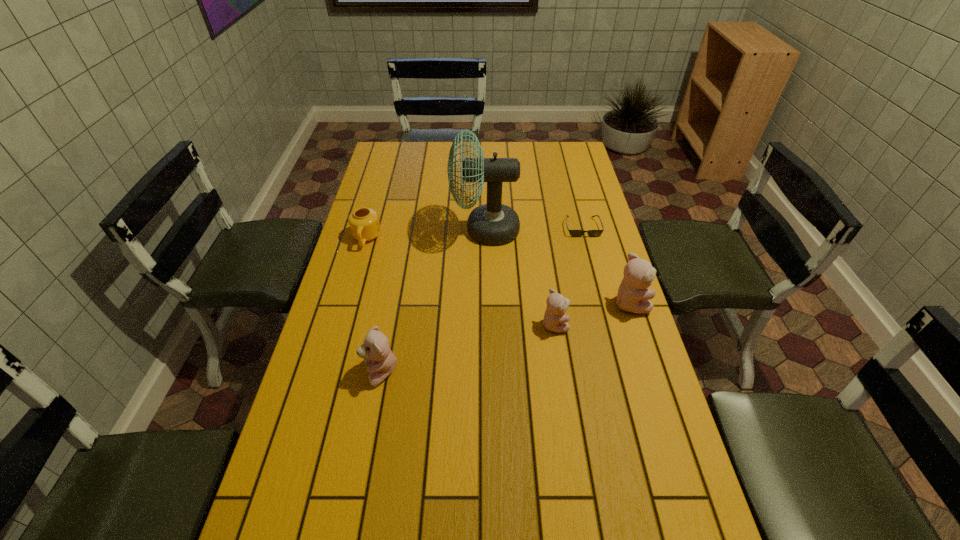
In order to click on teddy bear object that ranks as the second closest to the fifth object from right to left in this screenshot , I will do `click(633, 297)`.

The width and height of the screenshot is (960, 540). What are the coordinates of `vacant area that satisfies the following two spatial constraints: 1. on the front-facing side of the sunglasses; 2. at the face of the leftmost teddy bear` in the screenshot? It's located at (620, 373).

This screenshot has width=960, height=540. I want to click on vacant region that satisfies the following two spatial constraints: 1. on the front-facing side of the shortest object; 2. at the face of the fourth object from left to right, so click(x=608, y=324).

Find the location of a particular element. This screenshot has width=960, height=540. vacant space that satisfies the following two spatial constraints: 1. in front of the third object from left to right where the airflow is directed; 2. on the handle side of the fifth tallest object is located at coordinates (486, 239).